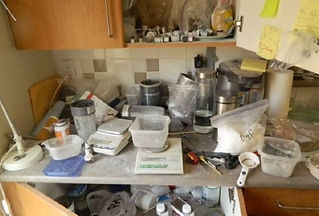
Where is `drawer handle`? The image size is (319, 216). drawer handle is located at coordinates (293, 208).